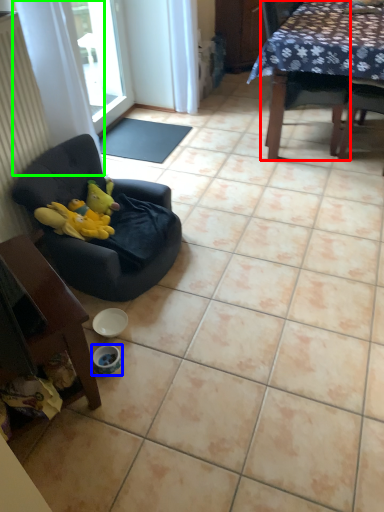
Question: Which object is positioned farthest from chair (highlighted by a red box)? Select from bowl (highlighted by a blue box) and curtain (highlighted by a green box).

Choices:
 (A) bowl
 (B) curtain

Answer: (A)